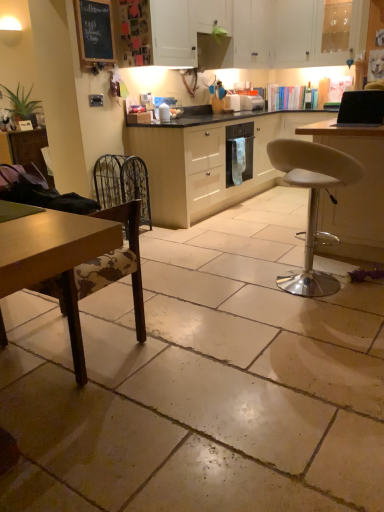
Where is `free area in between white leather stool at center-right, the second chair when ordered from left to right, and wooden chair at lower left, placed as the second chair when sorted from right to left`? The image size is (384, 512). free area in between white leather stool at center-right, the second chair when ordered from left to right, and wooden chair at lower left, placed as the second chair when sorted from right to left is located at coordinates (202, 312).